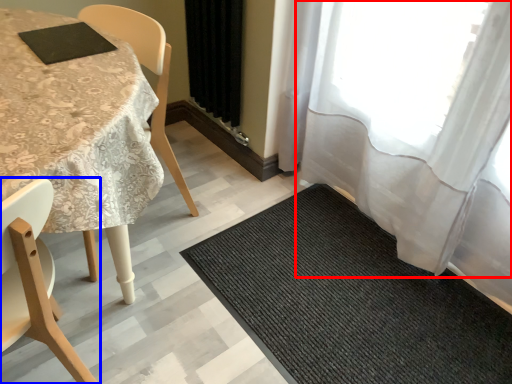
Question: Which point is closer to the camera, curtain (highlighted by a red box) or chair (highlighted by a blue box)?

Choices:
 (A) curtain
 (B) chair

Answer: (B)